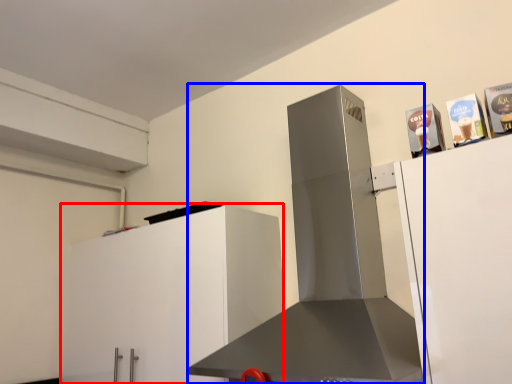
Question: Which of the following is the closest to the observer, cabinetry (highlighted by a red box) or home appliance (highlighted by a blue box)?

Choices:
 (A) cabinetry
 (B) home appliance

Answer: (B)